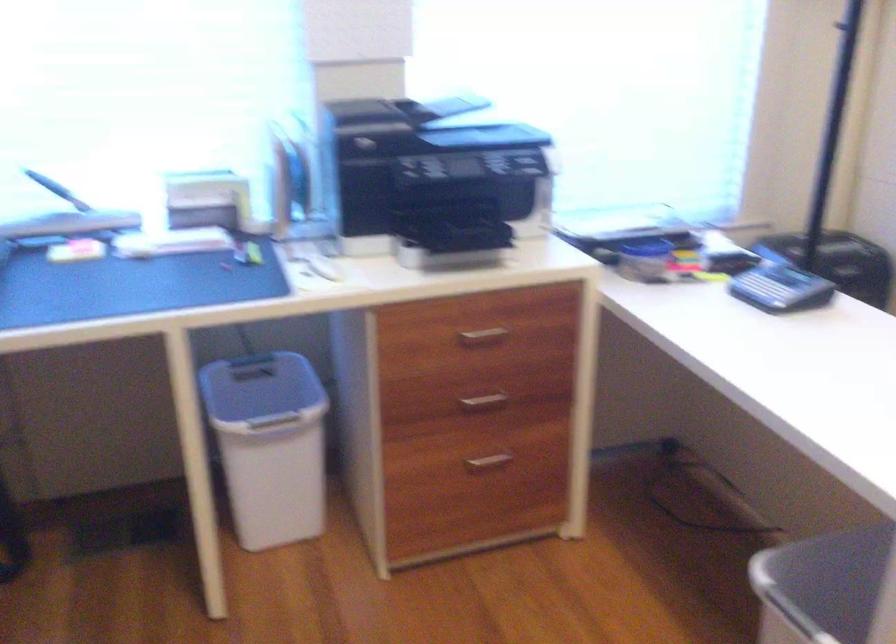
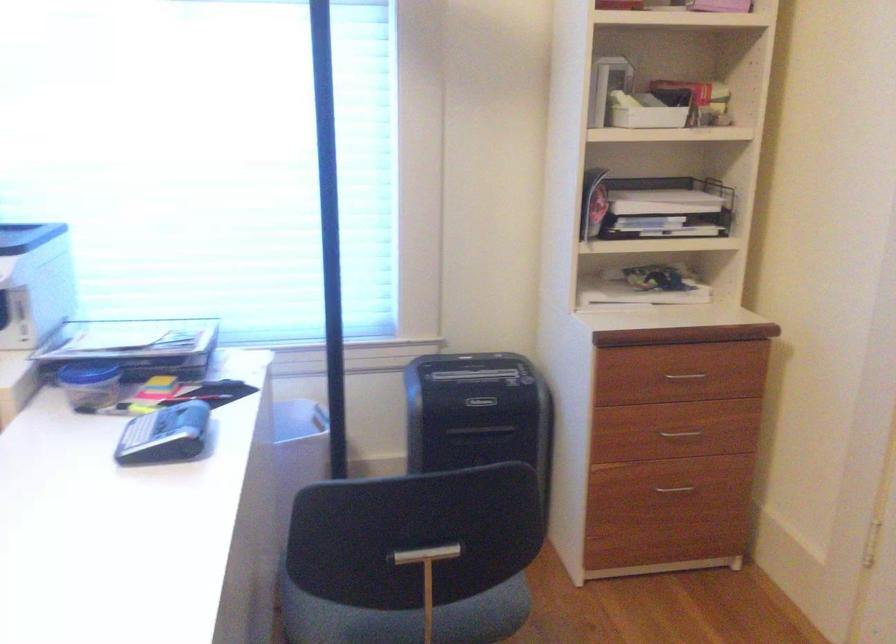
Question: In a continuous first-person perspective shot, in which direction is the camera moving?

Choices:
 (A) Left
 (B) Right
 (C) Forward
 (D) Backward

Answer: (B)